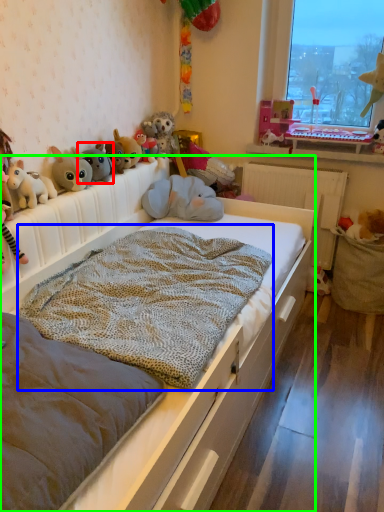
Question: Estimate the real-world distances between objects in this image. Which object is farther from toy (highlighted by a red box), blanket (highlighted by a blue box) or bed (highlighted by a green box)?

Choices:
 (A) blanket
 (B) bed

Answer: (B)